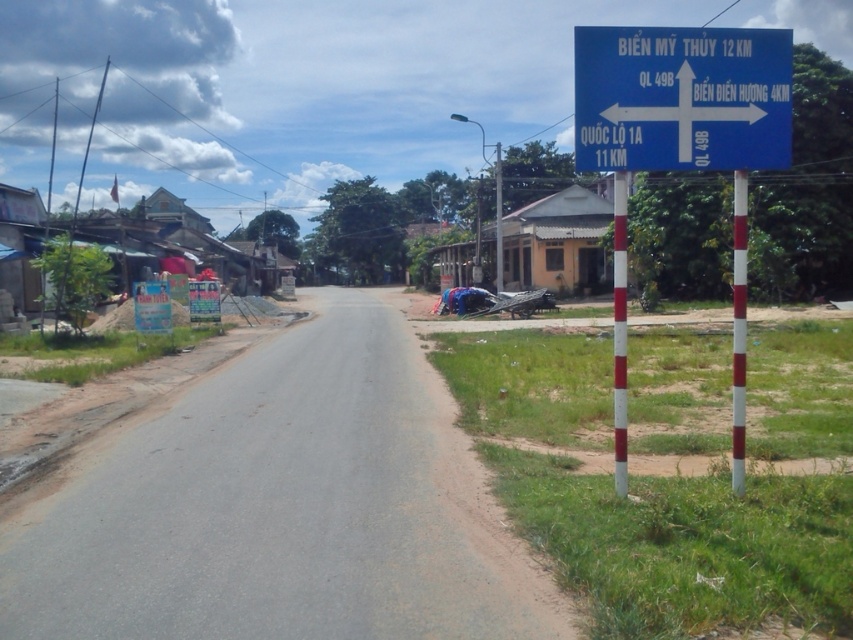
Between blue plastic signpost at right and red and white striped pole at center-right, which one has more height?

blue plastic signpost at right

Is blue plastic signpost at right positioned at the back of red and white striped pole at center-right?

That is False.

The width and height of the screenshot is (853, 640). Describe the element at coordinates (682, 147) in the screenshot. I see `blue plastic signpost at right` at that location.

The image size is (853, 640). I want to click on blue plastic signpost at right, so 682,147.

Does blue plastic signpost at right have a lesser height compared to white striped pole at right?

Incorrect, blue plastic signpost at right's height does not fall short of white striped pole at right's.

Who is lower down, blue plastic signpost at right or white striped pole at right?

Positioned lower is white striped pole at right.

Which is in front, point (613, 276) or point (614, 316)?

Point (614, 316)

I want to click on blue plastic signpost at right, so click(682, 147).

Is blue plastic sign at upper right below white striped pole at right?

No.

Is blue plastic sign at upper right positioned before white striped pole at right?

No.

Describe the element at coordinates (682, 99) in the screenshot. I see `blue plastic sign at upper right` at that location.

The width and height of the screenshot is (853, 640). Identify the location of blue plastic sign at upper right. (682, 99).